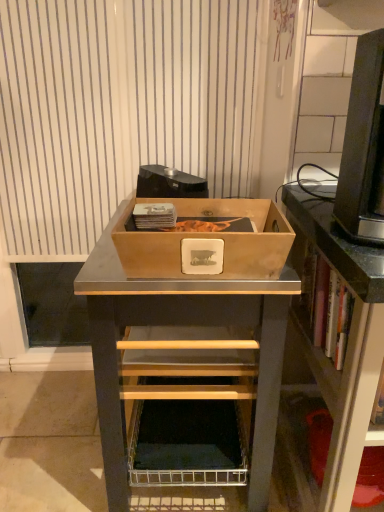
Question: Is point (11, 34) positioned closer to the camera than point (195, 388)?

Choices:
 (A) closer
 (B) farther

Answer: (B)

Question: From a real-world perspective, is white striped curtain at upper center physically located above or below wooden box at center?

Choices:
 (A) below
 (B) above

Answer: (B)

Question: Which of these objects is positioned farthest from the wooden box at center?

Choices:
 (A) white striped curtain at upper center
 (B) black plastic desktop computer at upper right
 (C) wooden box at center
 (D) matte black shelf at right

Answer: (A)

Question: Estimate the real-world distances between objects in this image. Which object is closer to the black plastic desktop computer at upper right?

Choices:
 (A) wooden box at center
 (B) matte black shelf at right
 (C) white striped curtain at upper center
 (D) wooden box at center

Answer: (B)